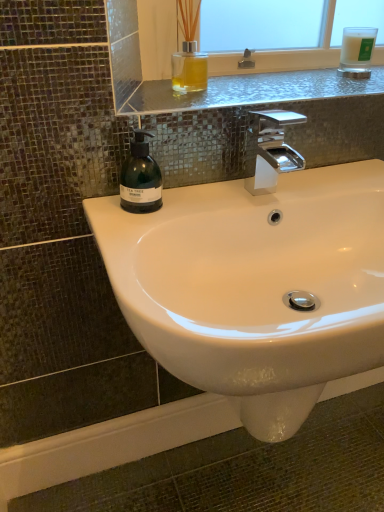
Measure the distance between green matte soap dispenser at left and camera.

green matte soap dispenser at left and camera are 27.99 inches apart from each other.

In order to face polished chrome faucet at center, should I rotate leftwards or rightwards?

To face it directly, rotate right by 10.795 degrees.

The height and width of the screenshot is (512, 384). Describe the element at coordinates (256, 285) in the screenshot. I see `white glossy sink at center` at that location.

Find the location of a particular element. white frosted glass candle at upper right is located at coordinates (357, 52).

Is white glossy sink at center further to camera compared to metallic glass shelf at upper center?

No.

Which of these two, white glossy sink at center or metallic glass shelf at upper center, is wider?

Wider between the two is white glossy sink at center.

Considering the relative sizes of white glossy sink at center and metallic glass shelf at upper center in the image provided, is white glossy sink at center bigger than metallic glass shelf at upper center?

Correct, white glossy sink at center is larger in size than metallic glass shelf at upper center.

What's the angular difference between white glossy sink at center and metallic glass shelf at upper center's facing directions?

There is a 0.127-degree angle between the facing directions of white glossy sink at center and metallic glass shelf at upper center.

At what (x,y) coordinates should I click in order to perform the action: click on tap in front of the metallic glass shelf at upper center. Please return your answer as a coordinate pair (x, y). The image size is (384, 512). Looking at the image, I should click on (274, 151).

Are polished chrome faucet at center and metallic glass shelf at upper center located far from each other?

That's not correct — polished chrome faucet at center is a little close to metallic glass shelf at upper center.

Is polished chrome faucet at center turned away from metallic glass shelf at upper center?

No, polished chrome faucet at center is not facing the opposite direction of metallic glass shelf at upper center.

Would you say polished chrome faucet at center is outside metallic glass shelf at upper center?

polished chrome faucet at center lies outside metallic glass shelf at upper center's area.

Does point (193, 223) come behind point (139, 144)?

No, it is not.

Between white glossy sink at center and green matte soap dispenser at left, which one is positioned in front?

Positioned in front is white glossy sink at center.

From the image's perspective, is white glossy sink at center positioned above or below green matte soap dispenser at left?

Based on their image positions, white glossy sink at center is located beneath green matte soap dispenser at left.

Which is correct: white glossy sink at center is inside green matte soap dispenser at left, or outside of it?

white glossy sink at center cannot be found inside green matte soap dispenser at left.

Between white frosted glass candle at upper right and metallic glass shelf at upper center, which one has more height?

With more height is white frosted glass candle at upper right.

Locate an element on the screen. mouthwash above the metallic glass shelf at upper center (from the image's perspective) is located at coordinates (357, 52).

From the image's perspective, which object appears higher, white frosted glass candle at upper right or metallic glass shelf at upper center?

From the image's view, white frosted glass candle at upper right is above.

Can you confirm if white frosted glass candle at upper right is wider than metallic glass shelf at upper center?

No.

How distant is metallic glass shelf at upper center from green matte soap dispenser at left?

metallic glass shelf at upper center is 9.84 inches from green matte soap dispenser at left.

Identify the location of window sill on the right of green matte soap dispenser at left. Image resolution: width=384 pixels, height=512 pixels. point(248,91).

Is metallic glass shelf at upper center oriented away from green matte soap dispenser at left?

metallic glass shelf at upper center does not have its back to green matte soap dispenser at left.

From the image's perspective, which is above, metallic glass shelf at upper center or green matte soap dispenser at left?

metallic glass shelf at upper center appears higher in the image.

What's the angular difference between metallic glass shelf at upper center and white frosted glass candle at upper right's facing directions?

metallic glass shelf at upper center and white frosted glass candle at upper right are facing 0.711 degrees away from each other.

Considering the sizes of metallic glass shelf at upper center and white frosted glass candle at upper right in the image, is metallic glass shelf at upper center bigger or smaller than white frosted glass candle at upper right?

Clearly, metallic glass shelf at upper center is larger in size than white frosted glass candle at upper right.

Is white frosted glass candle at upper right surrounded by metallic glass shelf at upper center?

No, metallic glass shelf at upper center does not contain white frosted glass candle at upper right.

Is metallic glass shelf at upper center further to camera compared to white frosted glass candle at upper right?

No, metallic glass shelf at upper center is in front of white frosted glass candle at upper right.

In the scene shown: Considering the positions of objects green matte soap dispenser at left and metallic glass shelf at upper center in the image provided, who is more to the right, green matte soap dispenser at left or metallic glass shelf at upper center?

metallic glass shelf at upper center is more to the right.

Which is behind, green matte soap dispenser at left or metallic glass shelf at upper center?

metallic glass shelf at upper center.

From the image's perspective, is green matte soap dispenser at left on metallic glass shelf at upper center?

Incorrect, from the image's perspective, green matte soap dispenser at left is lower than metallic glass shelf at upper center.

Find the location of a particular element. Image resolution: width=384 pixels, height=512 pixels. window sill above the white glossy sink at center (from a real-world perspective) is located at coordinates (248, 91).

Locate an element on the screen. The width and height of the screenshot is (384, 512). tap on the left of metallic glass shelf at upper center is located at coordinates (274, 151).

Based on the photo, from the image, which object appears to be farther from metallic glass shelf at upper center, polished chrome faucet at center or white glossy sink at center?

white glossy sink at center lies further to metallic glass shelf at upper center than the other object.

Looking at the image, which one is located closer to white frosted glass candle at upper right, green matte soap dispenser at left or white glossy sink at center?

white glossy sink at center.

Considering their positions, is white frosted glass candle at upper right positioned further to polished chrome faucet at center than green matte soap dispenser at left?

Among the two, white frosted glass candle at upper right is located further to polished chrome faucet at center.

Estimate the real-world distances between objects in this image. Which object is further from green matte soap dispenser at left, polished chrome faucet at center or metallic glass shelf at upper center?

Based on the image, metallic glass shelf at upper center appears to be further to green matte soap dispenser at left.

Which object lies nearer to the anchor point polished chrome faucet at center, metallic glass shelf at upper center or green matte soap dispenser at left?

metallic glass shelf at upper center lies closer to polished chrome faucet at center than the other object.

Estimate the real-world distances between objects in this image. Which object is further from metallic glass shelf at upper center, green matte soap dispenser at left or polished chrome faucet at center?

The object further to metallic glass shelf at upper center is green matte soap dispenser at left.

Based on their spatial positions, is white frosted glass candle at upper right or white glossy sink at center further from polished chrome faucet at center?

white frosted glass candle at upper right is further to polished chrome faucet at center.

Looking at the image, which one is located further to polished chrome faucet at center, metallic glass shelf at upper center or white glossy sink at center?

white glossy sink at center is positioned further to the anchor polished chrome faucet at center.

Where is `soap dispenser between white frosted glass candle at upper right and white glossy sink at center in the vertical direction`? soap dispenser between white frosted glass candle at upper right and white glossy sink at center in the vertical direction is located at coordinates (140, 177).

Locate an element on the screen. Image resolution: width=384 pixels, height=512 pixels. tap situated between green matte soap dispenser at left and metallic glass shelf at upper center from left to right is located at coordinates click(x=274, y=151).

Find the location of a particular element. This screenshot has width=384, height=512. tap between metallic glass shelf at upper center and white glossy sink at center in the up-down direction is located at coordinates click(x=274, y=151).

Where is `window sill between polished chrome faucet at center and white frosted glass candle at upper right in the front-back direction`? window sill between polished chrome faucet at center and white frosted glass candle at upper right in the front-back direction is located at coordinates (248, 91).